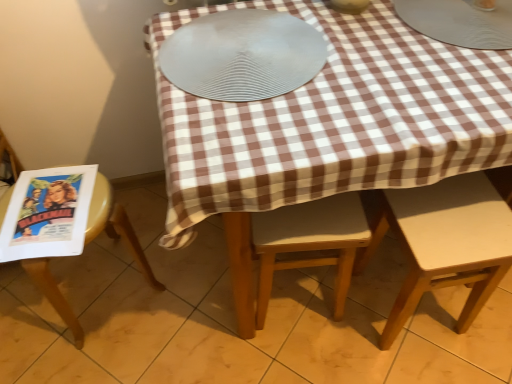
What are the coordinates of `vacant space in front of white matte chair at lower right, arranged as the 1th chair when viewed from the right` in the screenshot? It's located at (430, 365).